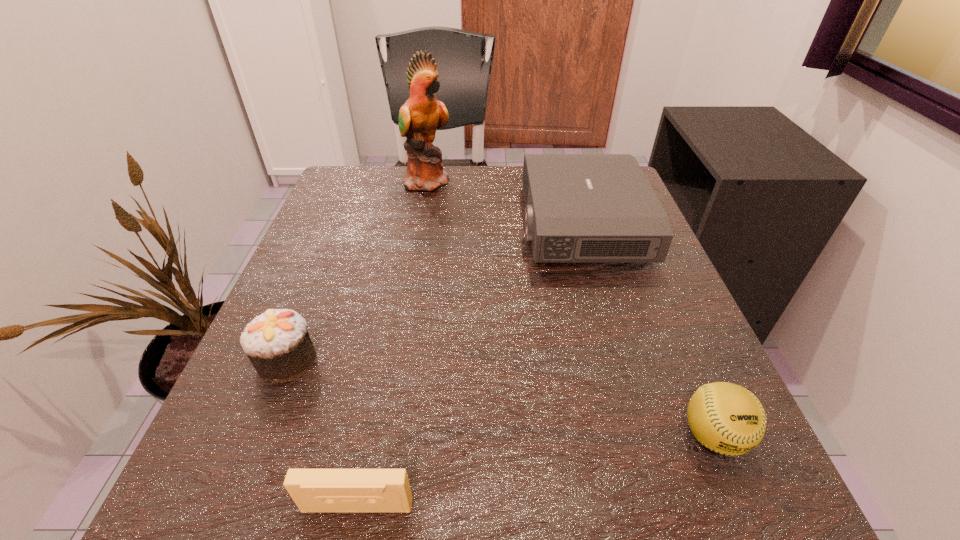
This screenshot has height=540, width=960. I want to click on object positioned at the near left corner, so click(313, 490).

Locate an element on the screen. This screenshot has height=540, width=960. object located at the far right corner is located at coordinates (579, 207).

Where is `object at the near right corner`? object at the near right corner is located at coordinates (726, 418).

Identify the location of vacant space at the far edge of the desktop. (427, 197).

Image resolution: width=960 pixels, height=540 pixels. Find the location of `free spot at the near edge of the desktop`. free spot at the near edge of the desktop is located at coordinates (418, 480).

You are a GUI agent. You are given a task and a screenshot of the screen. Output one action in this format:
    pyautogui.click(x=<x>, y=<y>)
    Task: Click on the free space at the left edge of the desktop
    This screenshot has width=960, height=540.
    Given the screenshot: What is the action you would take?
    pyautogui.click(x=352, y=227)

Where is `vacant space at the right edge`? vacant space at the right edge is located at coordinates (652, 332).

At what (x,y) coordinates should I click in order to perform the action: click on blank area at the far left corner. Please return your answer as a coordinate pair (x, y). The height and width of the screenshot is (540, 960). Looking at the image, I should click on (370, 212).

In order to click on free space between the cupcake and the softball in this screenshot , I will do `click(500, 398)`.

Identify the location of free point between the parrot and the fourth farthest object. Image resolution: width=960 pixels, height=540 pixels. (571, 308).